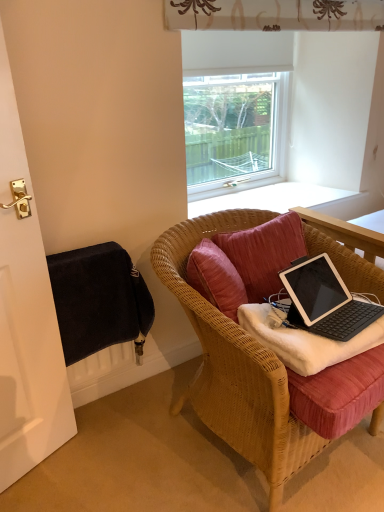
Find the location of a particular element. The height and width of the screenshot is (512, 384). white soft blanket at center is located at coordinates (305, 341).

Looking at this image, measure the distance between point (316, 333) and camera.

Point (316, 333) is 1.20 meters away from camera.

This screenshot has height=512, width=384. I want to click on black fabric radiator at lower left, so click(x=98, y=298).

What is the approximate width of velvet-like pink pillow at center?

12.48 inches.

Identify the location of black fabric at left. (29, 353).

This screenshot has width=384, height=512. Identify the location of white soft blanket at center. (305, 341).

I want to click on window that is on the left side of woven wood chair at center, so click(x=235, y=106).

Considering the sizes of objects woven wood chair at center and transparent glass window at upper center in the image provided, who is thinner, woven wood chair at center or transparent glass window at upper center?

transparent glass window at upper center is thinner.

Is woven wood chair at center positioned far away from transparent glass window at upper center?

They are positioned close to each other.

Would you say woven wood chair at center is outside transparent glass window at upper center?

woven wood chair at center lies outside transparent glass window at upper center's area.

Which is correct: transparent glass window at upper center is inside woven wood chair at center, or outside of it?

transparent glass window at upper center lies outside woven wood chair at center.

How far apart are transparent glass window at upper center and woven wood chair at center?

38.25 inches.

Is transparent glass window at upper center beside woven wood chair at center?

No, transparent glass window at upper center is not making contact with woven wood chair at center.

Considering the points (206, 175) and (313, 243), which point is in front, point (206, 175) or point (313, 243)?

The point (313, 243) is in front.

Is black fabric radiator at lower left positioned beyond the bounds of white soft blanket at center?

black fabric radiator at lower left is positioned outside white soft blanket at center.

Looking at their sizes, would you say black fabric radiator at lower left is wider or thinner than white soft blanket at center?

black fabric radiator at lower left is thinner than white soft blanket at center.

Considering the positions of objects black fabric radiator at lower left and white soft blanket at center in the image provided, who is in front, black fabric radiator at lower left or white soft blanket at center?

Positioned in front is white soft blanket at center.

From the image's perspective, who appears lower, black fabric radiator at lower left or white soft blanket at center?

white soft blanket at center.

Is transparent glass window at upper center aimed at velvet-like pink pillow at center?

Yes, transparent glass window at upper center is facing velvet-like pink pillow at center.

From the image's perspective, is transparent glass window at upper center beneath velvet-like pink pillow at center?

No.

Is transparent glass window at upper center far away from velvet-like pink pillow at center?

Actually, transparent glass window at upper center and velvet-like pink pillow at center are a little close together.

From a real-world perspective, between transparent glass window at upper center and velvet-like pink pillow at center, who is vertically lower?

In real-world perspective, velvet-like pink pillow at center is lower.

In the image, there is a black matte laptop at center. Identify the location of radiator below it (from the image's perspective). (98, 298).

Is black matte laptop at center facing towards black fabric radiator at lower left?

No.

Considering the positions of point (354, 302) and point (115, 291), is point (354, 302) closer or farther from the camera than point (115, 291)?

Clearly, point (354, 302) is closer to the camera than point (115, 291).

Which object is wider, black matte laptop at center or black fabric radiator at lower left?

black matte laptop at center is wider.

Where is `screen door on the left of transparent glass window at upper center`? screen door on the left of transparent glass window at upper center is located at coordinates (29, 353).

Considering the relative sizes of black fabric at left and transparent glass window at upper center in the image provided, is black fabric at left bigger than transparent glass window at upper center?

Correct, black fabric at left is larger in size than transparent glass window at upper center.

From the image's perspective, is black fabric at left on top of transparent glass window at upper center?

Answer: Actually, black fabric at left appears below transparent glass window at upper center in the image.

In the scene shown: Who is smaller, white soft blanket at center or black fabric radiator at lower left?

Smaller between the two is white soft blanket at center.

Which object is closer to the camera taking this photo, white soft blanket at center or black fabric radiator at lower left?

Positioned in front is white soft blanket at center.

Is white soft blanket at center oriented away from black fabric radiator at lower left?

white soft blanket at center is not turned away from black fabric radiator at lower left.

Which is more to the left, white soft blanket at center or black fabric radiator at lower left?

Positioned to the left is black fabric radiator at lower left.

Identify the location of chair in front of the transparent glass window at upper center. This screenshot has height=512, width=384. (235, 365).

Locate an element on the screen. Image resolution: width=384 pixels, height=512 pixels. window that appears above the woven wood chair at center (from the image's perspective) is located at coordinates [235, 106].

When comparing their distances from black fabric radiator at lower left, does velvet-like pink pillow at center or woven wood chair at center seem closer?

woven wood chair at center lies closer to black fabric radiator at lower left than the other object.

Based on their spatial positions, is black fabric radiator at lower left or velvet-like pink pillow at center further from black matte laptop at center?

black fabric radiator at lower left.

Looking at the image, which one is located closer to velvet-like pink pillow at center, woven wood chair at center or black matte laptop at center?

woven wood chair at center is closer to velvet-like pink pillow at center.

Looking at the image, which one is located closer to woven wood chair at center, black fabric at left or black matte laptop at center?

black matte laptop at center is closer to woven wood chair at center.

When comparing their distances from velvet-like pink pillow at center, does black fabric radiator at lower left or woven wood chair at center seem further?

black fabric radiator at lower left.

From the picture: From the image, which object appears to be nearer to black fabric at left, black matte laptop at center or black fabric radiator at lower left?

Among the two, black fabric radiator at lower left is located nearer to black fabric at left.

Consider the image. Based on their spatial positions, is velvet-like pink pillow at center or transparent glass window at upper center further from black matte laptop at center?

transparent glass window at upper center lies further to black matte laptop at center than the other object.

In the scene shown: Estimate the real-world distances between objects in this image. Which object is closer to black matte laptop at center, transparent glass window at upper center or white soft blanket at center?

Among the two, white soft blanket at center is located nearer to black matte laptop at center.

At what (x,y) coordinates should I click in order to perform the action: click on chair between black fabric radiator at lower left and white soft blanket at center from left to right. Please return your answer as a coordinate pair (x, y). This screenshot has width=384, height=512. Looking at the image, I should click on (235, 365).

The image size is (384, 512). I want to click on blanket between black fabric at left and black matte laptop at center, so click(305, 341).

At what (x,y) coordinates should I click in order to perform the action: click on pillow between transparent glass window at upper center and woven wood chair at center vertically. Please return your answer as a coordinate pair (x, y). Looking at the image, I should click on (264, 253).

Identify the location of radiator between black fabric at left and woven wood chair at center. This screenshot has width=384, height=512. click(98, 298).